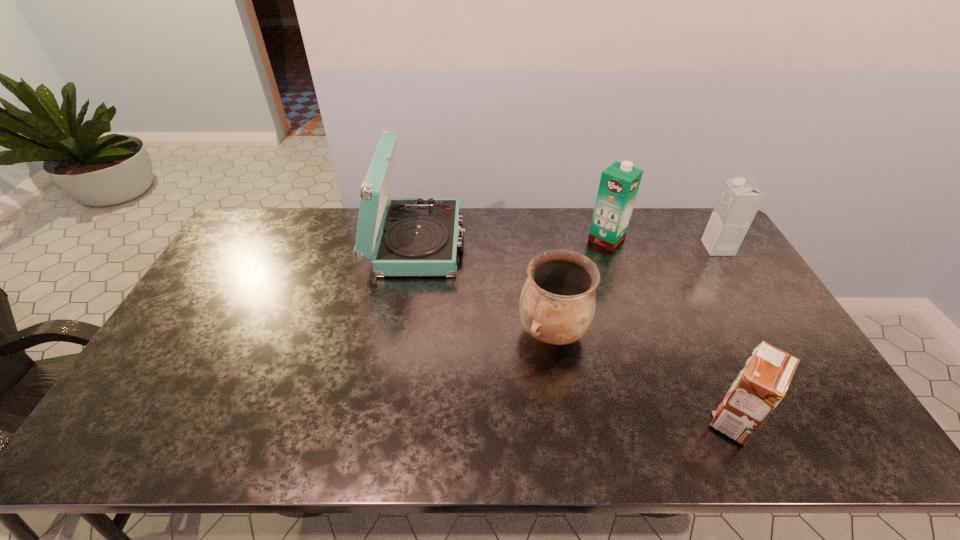
Identify the location of free area in between the third object from right to left and the record player. Image resolution: width=960 pixels, height=540 pixels. (512, 241).

Locate an element on the screen. This screenshot has width=960, height=540. free space between the rightmost object and the nearest object is located at coordinates (726, 333).

Identify the location of blank region between the rightmost object and the leftmost carton. This screenshot has width=960, height=540. (662, 244).

This screenshot has width=960, height=540. In order to click on object that stands as the third closest to the leftmost object in this screenshot , I will do `click(763, 382)`.

Locate an element on the screen. The width and height of the screenshot is (960, 540). the second closest object relative to the shortest carton is located at coordinates (740, 198).

Identify which carton is the third closest to the record player. Please provide its 2D coordinates. Your answer should be formatted as a tuple, i.e. [(x, y)], where the tuple contains the x and y coordinates of a point satisfying the conditions above.

[(740, 198)]

Identify which carton is located as the second nearest to the third object from right to left. Please provide its 2D coordinates. Your answer should be formatted as a tuple, i.e. [(x, y)], where the tuple contains the x and y coordinates of a point satisfying the conditions above.

[(763, 382)]

In order to click on free spot that satisfies the following two spatial constraints: 1. on the face side of the record player; 2. on the back side of the urn in this screenshot , I will do `click(402, 332)`.

I want to click on free spot that satisfies the following two spatial constraints: 1. on the face side of the record player; 2. on the left side of the second object from left to right, so click(402, 332).

Locate an element on the screen. Image resolution: width=960 pixels, height=540 pixels. free space that satisfies the following two spatial constraints: 1. on the face side of the leftmost object; 2. on the back side of the second nearest object is located at coordinates (402, 332).